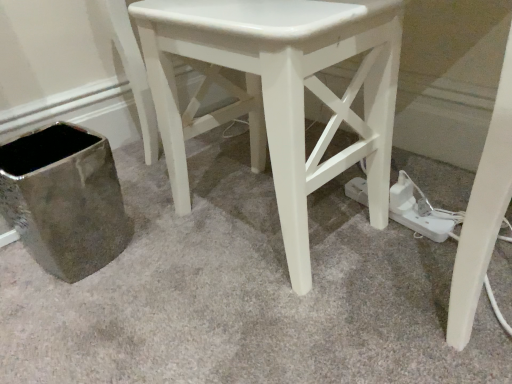
You are a GUI agent. You are given a task and a screenshot of the screen. Output one action in this format:
    pyautogui.click(x=<x>, y=<y>)
    Task: Click on the white plastic plug at lower right
    
    Given the screenshot: What is the action you would take?
    pyautogui.click(x=415, y=212)

The width and height of the screenshot is (512, 384). What do you see at coordinates (415, 212) in the screenshot?
I see `white plastic plug at lower right` at bounding box center [415, 212].

This screenshot has height=384, width=512. Describe the element at coordinates (279, 93) in the screenshot. I see `white glossy stool at center` at that location.

What is the approximate width of white glossy stool at center?

The width of white glossy stool at center is 12.79 inches.

You are a GUI agent. You are given a task and a screenshot of the screen. Output one action in this format:
    pyautogui.click(x=<x>, y=<y>)
    Task: Click on the white glossy stool at center
    Image resolution: width=512 pixels, height=384 pixels.
    Given the screenshot: What is the action you would take?
    pyautogui.click(x=279, y=93)

Locate an element on the screen. The height and width of the screenshot is (384, 512). white plastic plug at lower right is located at coordinates pos(415,212).

Based on the photo, is white glossy stool at center at the left side of white plastic plug at lower right?

Correct, you'll find white glossy stool at center to the left of white plastic plug at lower right.

Which object is more forward, white glossy stool at center or white plastic plug at lower right?

white glossy stool at center is in front.

Which is further, [221,44] or [408,181]?

The point [408,181] is more distant.

From the image's perspective, does white glossy stool at center appear higher than white plastic plug at lower right?

Yes.

From a real-world perspective, who is located lower, white glossy stool at center or white plastic plug at lower right?

From a 3D spatial view, white plastic plug at lower right is below.

Looking at their sizes, would you say white glossy stool at center is wider or thinner than white plastic plug at lower right?

white glossy stool at center is wider than white plastic plug at lower right.

Can you confirm if white glossy stool at center is shorter than white plastic plug at lower right?

No.

Who is bigger, white glossy stool at center or white plastic plug at lower right?

white glossy stool at center is bigger.

Is white glossy stool at center inside or outside of white plastic plug at lower right?

white glossy stool at center is not inside white plastic plug at lower right, it's outside.

Consider the image. Is white glossy stool at center in contact with white plastic plug at lower right?

No, white glossy stool at center is not next to white plastic plug at lower right.

Does white glossy stool at center turn towards white plastic plug at lower right?

No, white glossy stool at center is not oriented towards white plastic plug at lower right.

What's the angular difference between white glossy stool at center and white plastic plug at lower right's facing directions?

white glossy stool at center and white plastic plug at lower right are facing 5.97 degrees away from each other.

Where is `plug that appears below the white glossy stool at center (from the image's perspective)`? plug that appears below the white glossy stool at center (from the image's perspective) is located at coordinates (415, 212).

Would you say white plastic plug at lower right is to the left or to the right of white glossy stool at center in the picture?

Clearly, white plastic plug at lower right is on the right of white glossy stool at center in the image.

In the image, is white plastic plug at lower right positioned in front of or behind white glossy stool at center?

In the image, white plastic plug at lower right appears behind white glossy stool at center.

Is point (443, 235) positioned behind point (163, 120)?

That is False.

In the scene shown: From the image's perspective, is white plastic plug at lower right on white glossy stool at center?

Incorrect, from the image's perspective, white plastic plug at lower right is lower than white glossy stool at center.

From a real-world perspective, is white plastic plug at lower right beneath white glossy stool at center?

Yes, from a real-world perspective, white plastic plug at lower right is below white glossy stool at center.

Is white plastic plug at lower right wider or thinner than white glossy stool at center?

white plastic plug at lower right is thinner than white glossy stool at center.

In the scene shown: Does white plastic plug at lower right have a greater height compared to white glossy stool at center?

Incorrect, the height of white plastic plug at lower right is not larger of that of white glossy stool at center.

Considering the relative sizes of white plastic plug at lower right and white glossy stool at center in the image provided, is white plastic plug at lower right bigger than white glossy stool at center?

No.

Is white plastic plug at lower right not inside white glossy stool at center?

Yes, white plastic plug at lower right is outside of white glossy stool at center.

Is white plastic plug at lower right far from white glossy stool at center?

No, white plastic plug at lower right is not far from white glossy stool at center.

Is white plastic plug at lower right oriented away from white glossy stool at center?

white plastic plug at lower right does not have its back to white glossy stool at center.

Find the location of a particular element. The width and height of the screenshot is (512, 384). plug that appears on the right of white glossy stool at center is located at coordinates (415, 212).

There is a white plastic plug at lower right. At what (x,y) coordinates should I click in order to perform the action: click on stool above it (from a real-world perspective). Please return your answer as a coordinate pair (x, y). Image resolution: width=512 pixels, height=384 pixels. Looking at the image, I should click on (279, 93).

In order to click on plug on the right side of white glossy stool at center in this screenshot , I will do (415, 212).